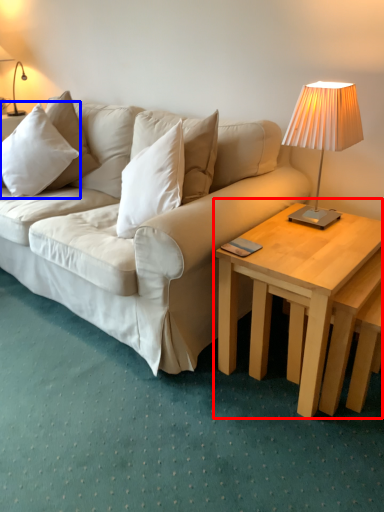
Question: Which object appears closest to the camera in this image, coffee table (highlighted by a red box) or pillow (highlighted by a blue box)?

Choices:
 (A) coffee table
 (B) pillow

Answer: (A)